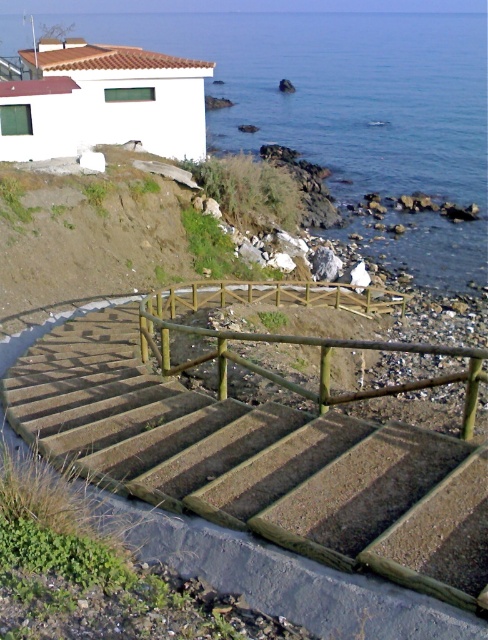
Is concrete textured stairs at center to the left of wooden rail at center from the viewer's perspective?

Yes, concrete textured stairs at center is to the left of wooden rail at center.

Does concrete textured stairs at center have a smaller size compared to wooden rail at center?

Yes, concrete textured stairs at center is smaller than wooden rail at center.

The height and width of the screenshot is (640, 488). What are the coordinates of `concrete textured stairs at center` in the screenshot? It's located at (x=286, y=579).

Is blue water at upper center positioned behind concrete textured stairs at center?

Result: Yes, it is behind concrete textured stairs at center.

Which is more to the left, blue water at upper center or concrete textured stairs at center?

concrete textured stairs at center is more to the left.

Does point (344, 154) come behind point (434, 632)?

That is True.

This screenshot has width=488, height=640. Find the location of `blue water at upper center`. blue water at upper center is located at coordinates (349, 109).

In the scene shown: Does blue water at upper center have a greater width compared to wooden rail at center?

Indeed, blue water at upper center has a greater width compared to wooden rail at center.

Between blue water at upper center and wooden rail at center, which one is positioned higher?

blue water at upper center is above.

The width and height of the screenshot is (488, 640). What do you see at coordinates (349, 109) in the screenshot?
I see `blue water at upper center` at bounding box center [349, 109].

The height and width of the screenshot is (640, 488). I want to click on blue water at upper center, so click(x=349, y=109).